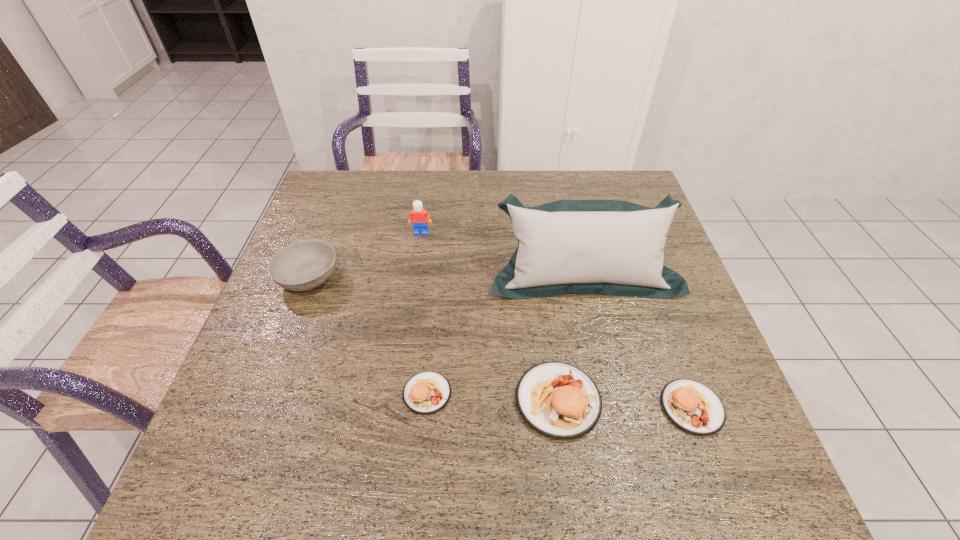
Please point a spot to add another patty on the left. Please provide its 2D coordinates. Your answer should be formatted as a tuple, i.e. [(x, y)], where the tuple contains the x and y coordinates of a point satisfying the conditions above.

[(300, 386)]